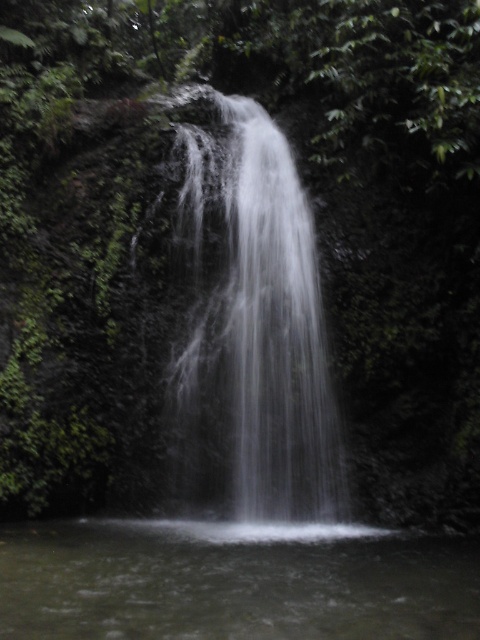
Question: Is white frothy water at center positioned at the back of clear water at center?

Choices:
 (A) yes
 (B) no

Answer: (A)

Question: Is white frothy water at center wider than clear water at center?

Choices:
 (A) yes
 (B) no

Answer: (B)

Question: Which of the following is the farthest from the observer?

Choices:
 (A) (190, 464)
 (B) (95, 600)

Answer: (A)

Question: Which point is farther to the camera?

Choices:
 (A) white frothy water at center
 (B) clear water at center

Answer: (A)

Question: Is white frothy water at center positioned at the back of clear water at center?

Choices:
 (A) yes
 (B) no

Answer: (A)